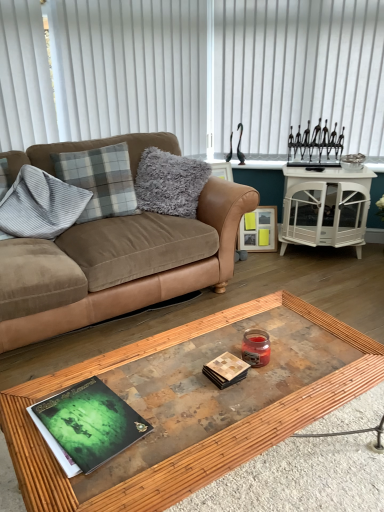
The width and height of the screenshot is (384, 512). I want to click on vacant space situated above green matte book at center, the 2th magazine positioned from the right (from a real-world perspective), so click(x=91, y=416).